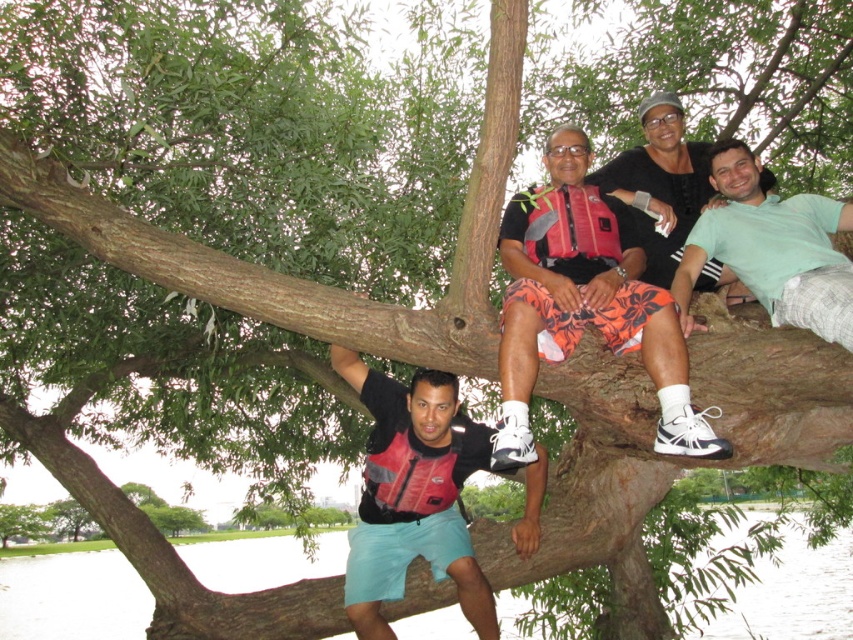
You are a photographer trying to capture a candid shot of the two people in the scene. You notice the floral shorts at center and the green cotton shirt at upper right. Which clothing item is located to the left of the other?

The floral shorts at center is positioned on the left side of green cotton shirt at upper right.